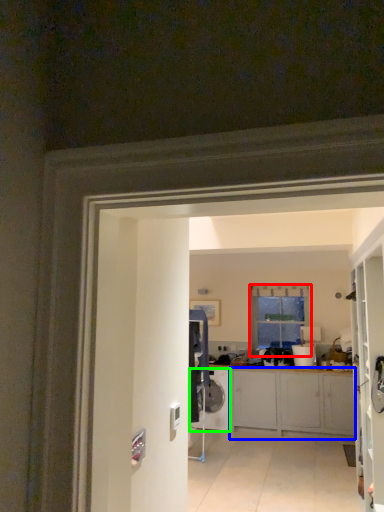
Question: Which object is positioned closest to window (highlighted by a red box)? Select from cabinetry (highlighted by a blue box) and washing machine (highlighted by a green box).

Choices:
 (A) cabinetry
 (B) washing machine

Answer: (A)